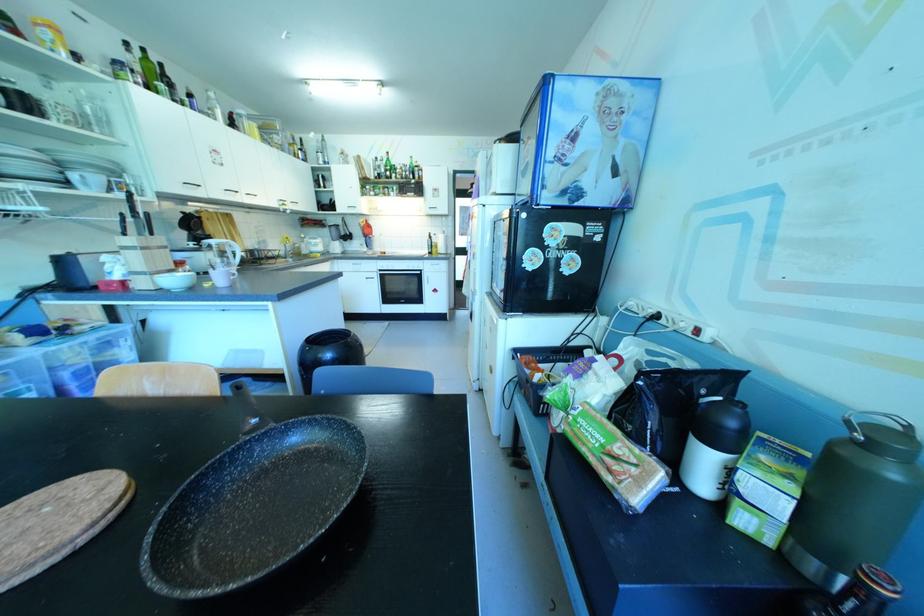
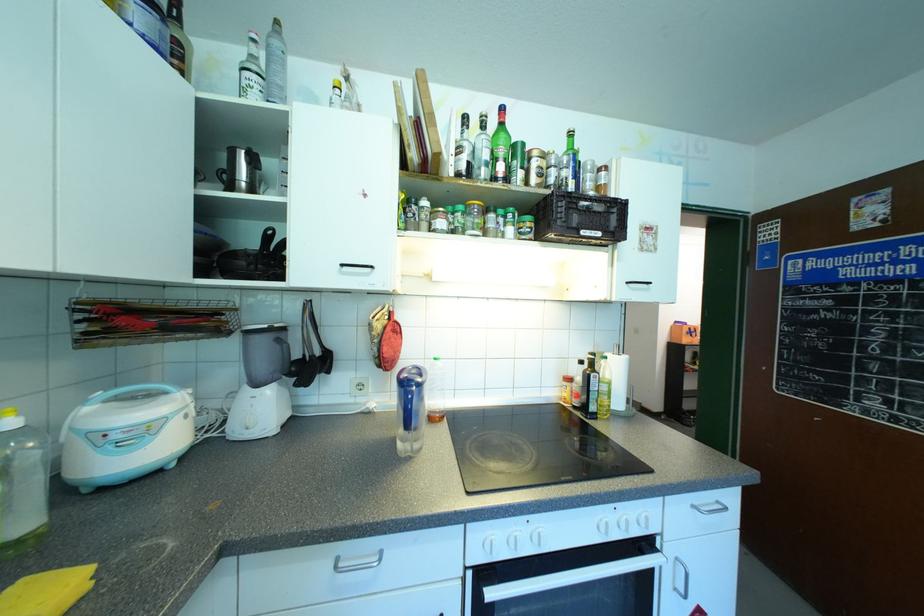
In the second image, find the point that corresponds to the point at 371,192 in the first image.

(440, 223)